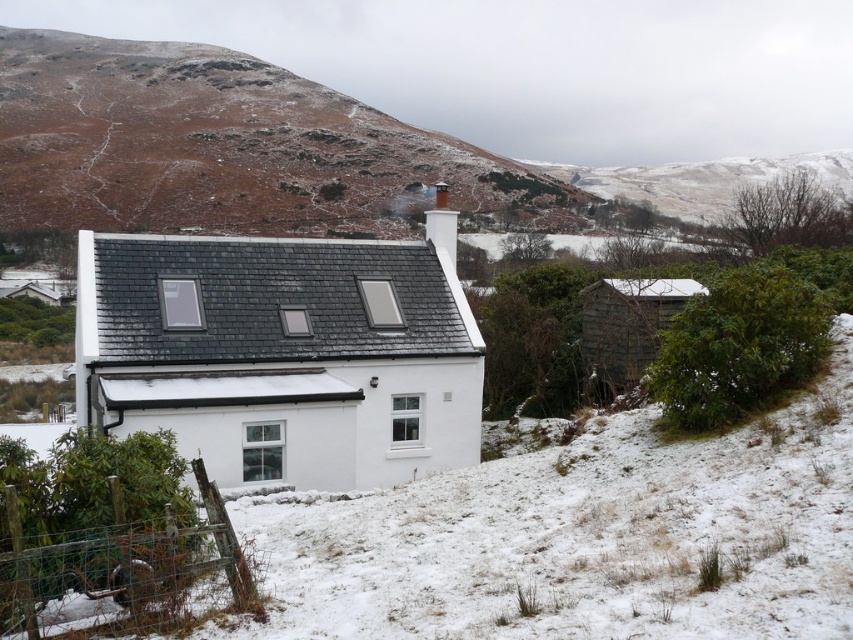
Which is more to the right, brown textured rock at upper left or wooden shed at right?

Positioned to the right is wooden shed at right.

Which of these two, brown textured rock at upper left or wooden shed at right, stands taller?

Standing taller between the two is brown textured rock at upper left.

Where is `brown textured rock at upper left`? This screenshot has height=640, width=853. brown textured rock at upper left is located at coordinates pyautogui.click(x=225, y=147).

The width and height of the screenshot is (853, 640). I want to click on brown textured rock at upper left, so click(225, 147).

Is white slate roof at center to the left of brown textured rock at upper left from the viewer's perspective?

In fact, white slate roof at center is to the right of brown textured rock at upper left.

Is white slate roof at center taller than brown textured rock at upper left?

Incorrect, white slate roof at center's height is not larger of brown textured rock at upper left's.

Who is more distant from viewer, (375, 355) or (281, 84)?

The point (281, 84) is more distant.

The width and height of the screenshot is (853, 640). What are the coordinates of `white slate roof at center` in the screenshot? It's located at (283, 353).

From the picture: Does white slate roof at center have a greater width compared to wooden shed at right?

Yes.

Who is more forward, (317, 317) or (604, 358)?

Point (317, 317)

Find the location of a particular element. The height and width of the screenshot is (640, 853). white slate roof at center is located at coordinates (283, 353).